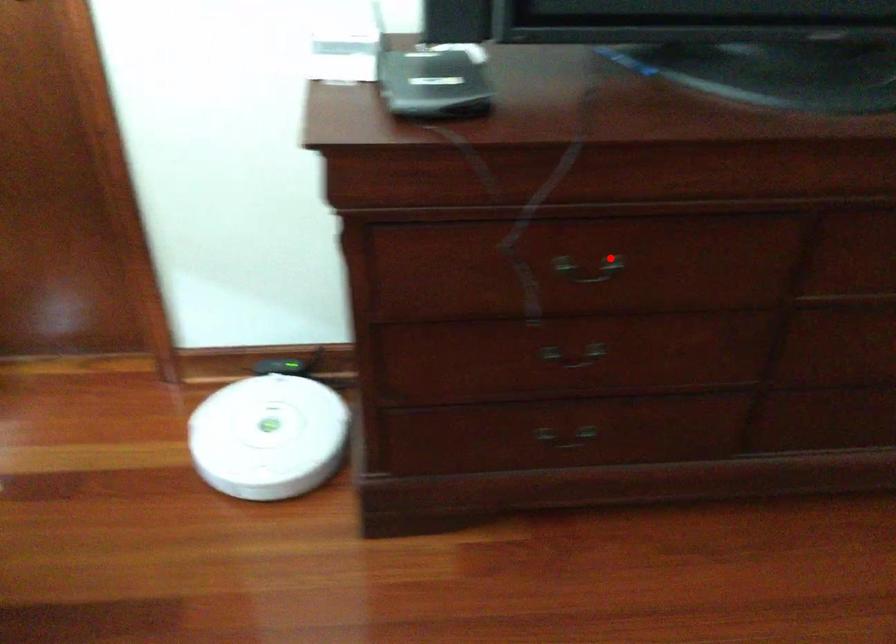
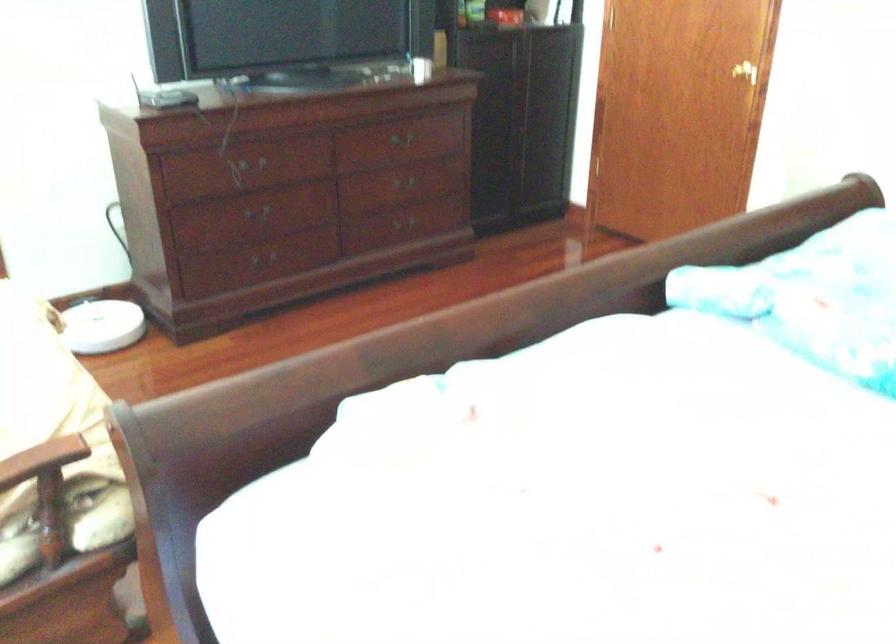
The point at the highlighted location is marked in the first image. Where is the corresponding point in the second image?

(255, 164)